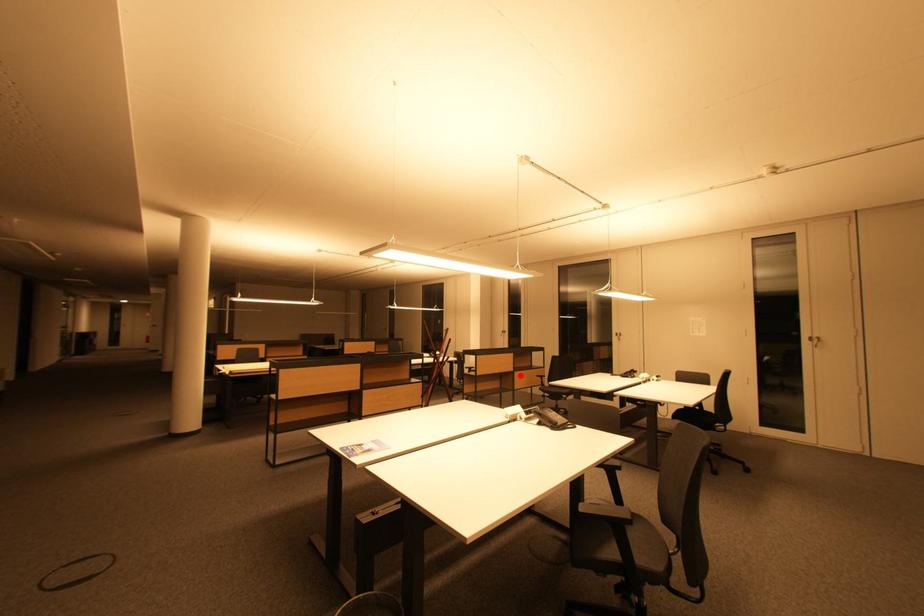
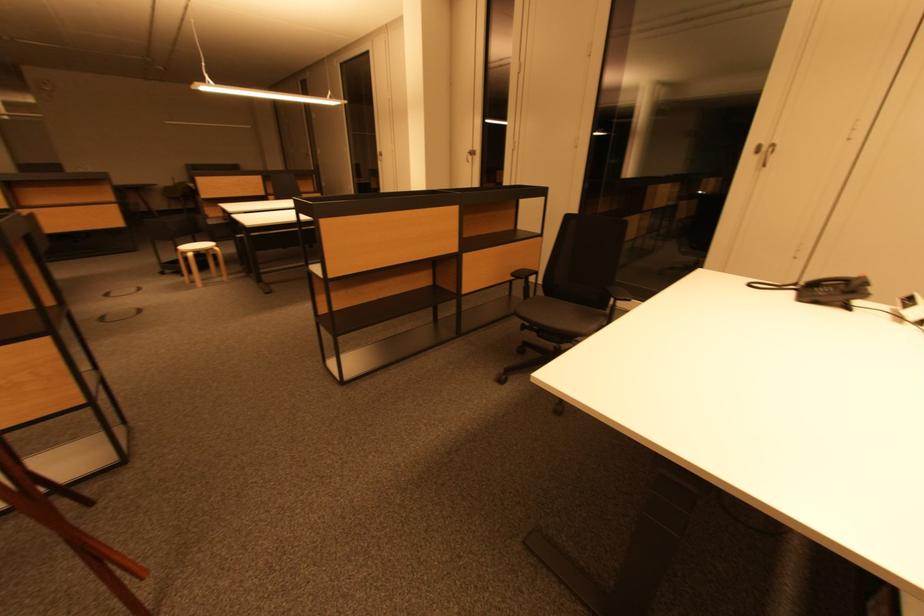
In the second image, find the point that corresponds to the highlighted location in the first image.

(470, 259)